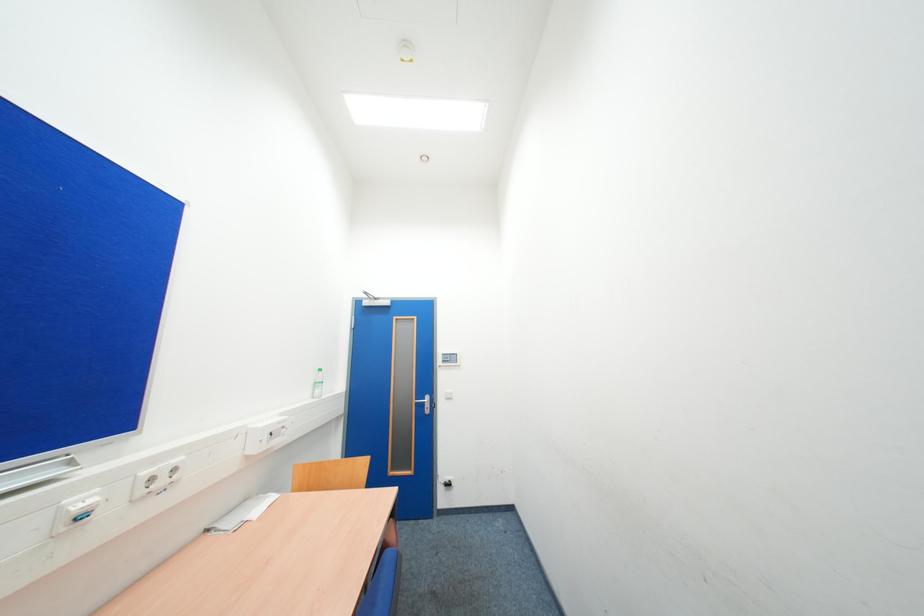
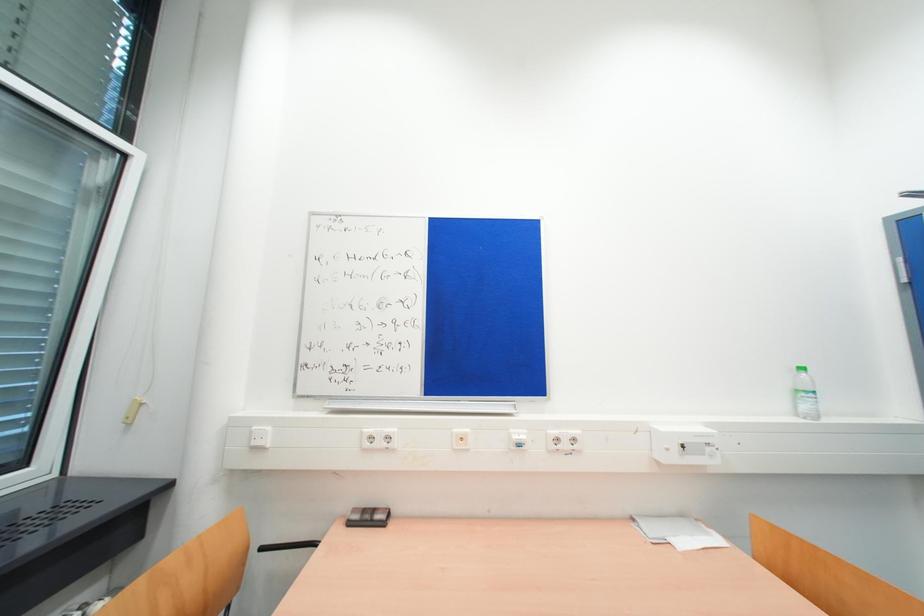
Question: The images are taken continuously from a first-person perspective. In which direction is your viewpoint rotating?

Choices:
 (A) Left
 (B) Right
 (C) Up
 (D) Down

Answer: (A)